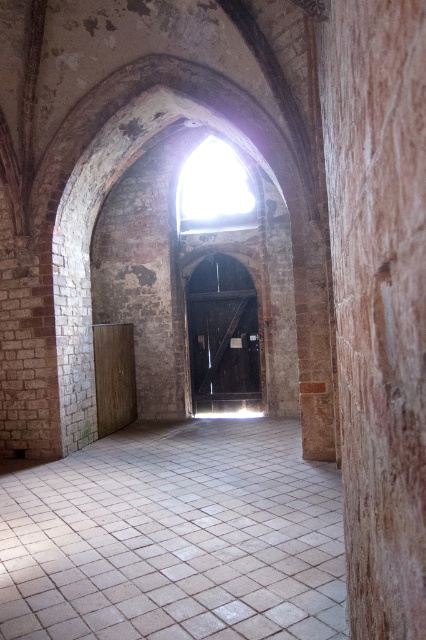
You are standing at the entrance of this historic building and want to walk towards the large arched window. You notice the white tile floor at center and the brown polished wood pillar at right. Which object is lower in height? Please answer based on the scene description.

The white tile floor at center has a lesser height compared to the brown polished wood pillar at right, so the white tile floor at center is lower in height.